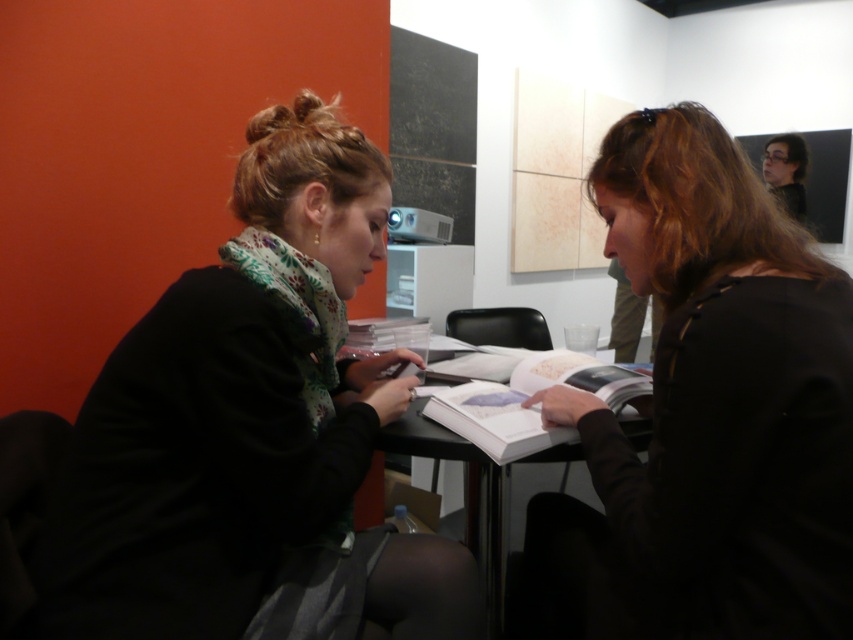
Is black matte jacket at center closer to the viewer compared to white paper book at center?

Yes, it is.

Who is higher up, black matte jacket at center or white paper book at center?

white paper book at center is higher up.

Who is more distant from viewer, (817,368) or (526,452)?

The point (526,452) is more distant.

The image size is (853, 640). Find the location of `black matte jacket at center`. black matte jacket at center is located at coordinates (706, 413).

How distant is black matte jacket at left from black matte jacket at center?

black matte jacket at left is 15.17 inches away from black matte jacket at center.

Is the position of black matte jacket at left less distant than that of black matte jacket at center?

No, it is behind black matte jacket at center.

What do you see at coordinates (254, 429) in the screenshot? This screenshot has height=640, width=853. I see `black matte jacket at left` at bounding box center [254, 429].

Locate an element on the screen. This screenshot has width=853, height=640. black matte jacket at left is located at coordinates (254, 429).

Does black matte jacket at left appear under black plastic table at center?

No.

Is black matte jacket at left thinner than black plastic table at center?

In fact, black matte jacket at left might be wider than black plastic table at center.

Is point (397, 355) less distant than point (467, 465)?

Yes, point (397, 355) is closer to viewer.

Locate an element on the screen. The width and height of the screenshot is (853, 640). black matte jacket at left is located at coordinates (254, 429).